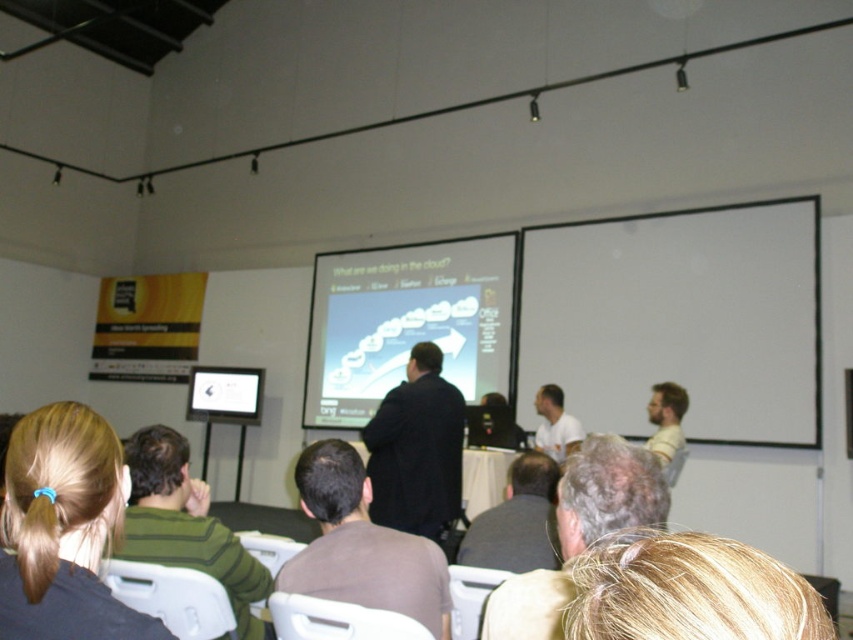
Describe the element at coordinates (679, 320) in the screenshot. I see `white matte projection screen at upper center` at that location.

Is white matte projection screen at upper center bigger than gray fabric shirt at center?

Correct, white matte projection screen at upper center is larger in size than gray fabric shirt at center.

I want to click on white matte projection screen at upper center, so click(x=679, y=320).

Describe the element at coordinates (679, 320) in the screenshot. This screenshot has width=853, height=640. I see `white matte projection screen at upper center` at that location.

Does point (693, 380) come closer to viewer compared to point (457, 483)?

No, (693, 380) is behind (457, 483).

This screenshot has width=853, height=640. I want to click on white matte projection screen at upper center, so click(679, 320).

In the scene shown: Does blonde hair at upper center have a lesser height compared to brown matte shirt at center?

Correct, blonde hair at upper center is not as tall as brown matte shirt at center.

Is point (793, 616) positioned before point (311, 552)?

Yes, it is in front of point (311, 552).

Does point (610, 637) come closer to viewer compared to point (434, 556)?

Yes, it is.

The width and height of the screenshot is (853, 640). I want to click on blonde hair at upper center, so click(x=688, y=592).